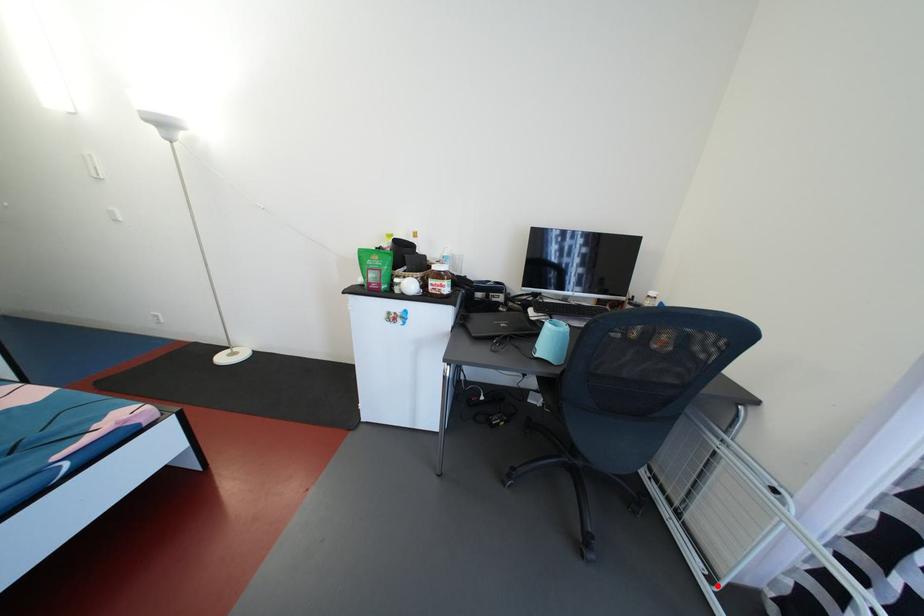
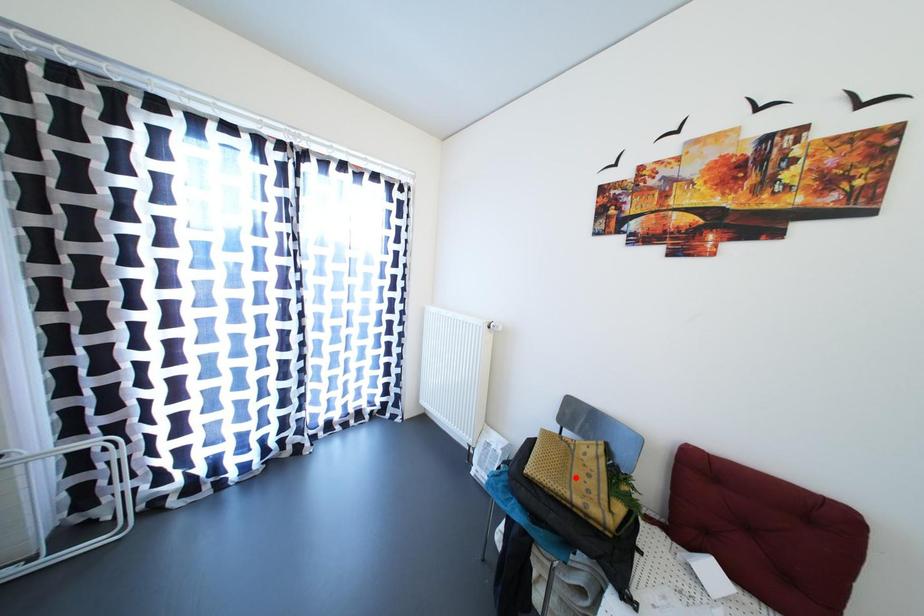
I am providing you with two images of the same scene from different viewpoints. A red point is marked on the first image and another point is marked on the second image. Is the red point in image1 aligned with the point shown in image2?

No